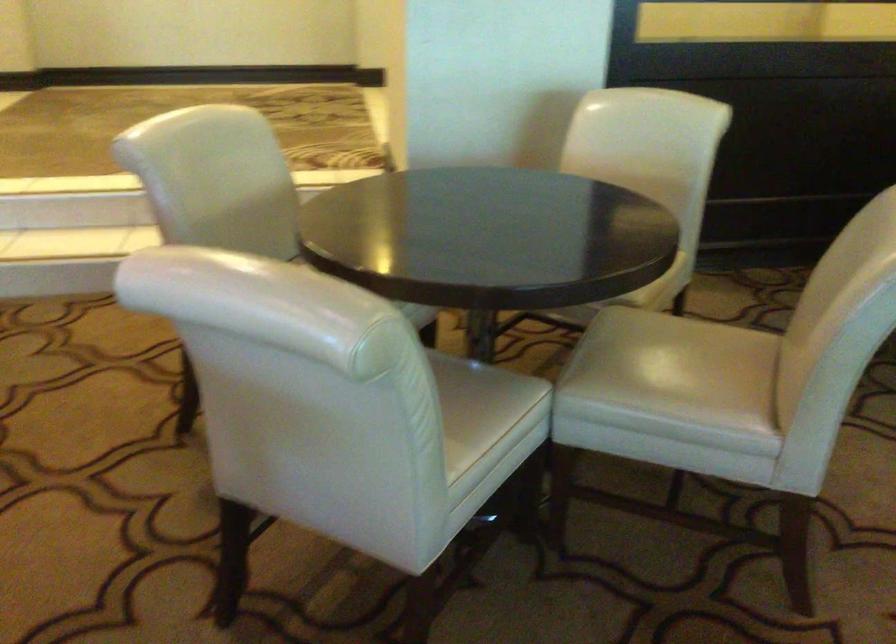
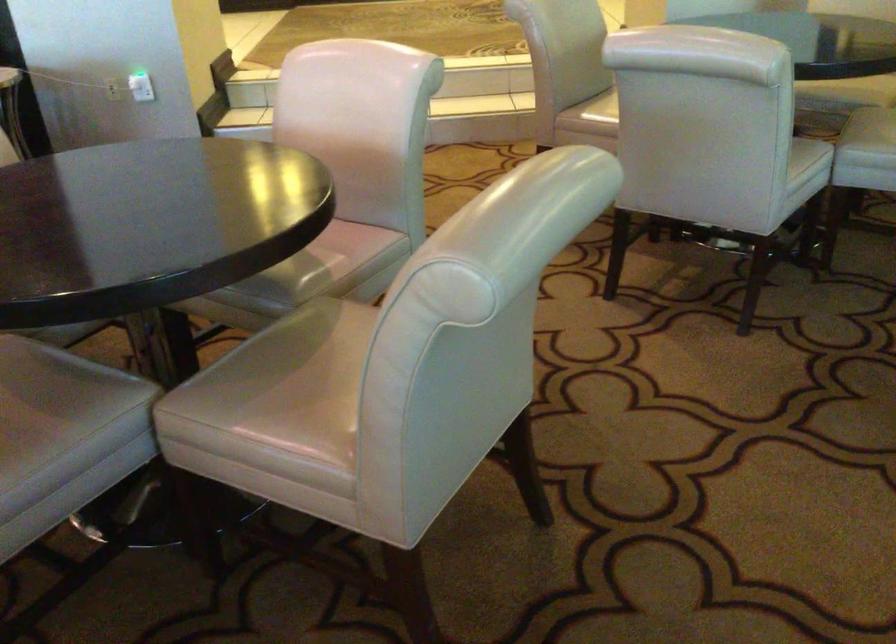
The point at [604,370] is marked in the first image. Where is the corresponding point in the second image?

(874, 125)